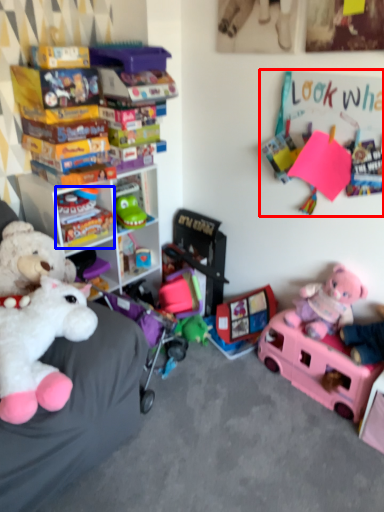
Question: Which object appears farthest to the camera in this image, bulletin board (highlighted by a red box) or toy (highlighted by a blue box)?

Choices:
 (A) bulletin board
 (B) toy

Answer: (B)